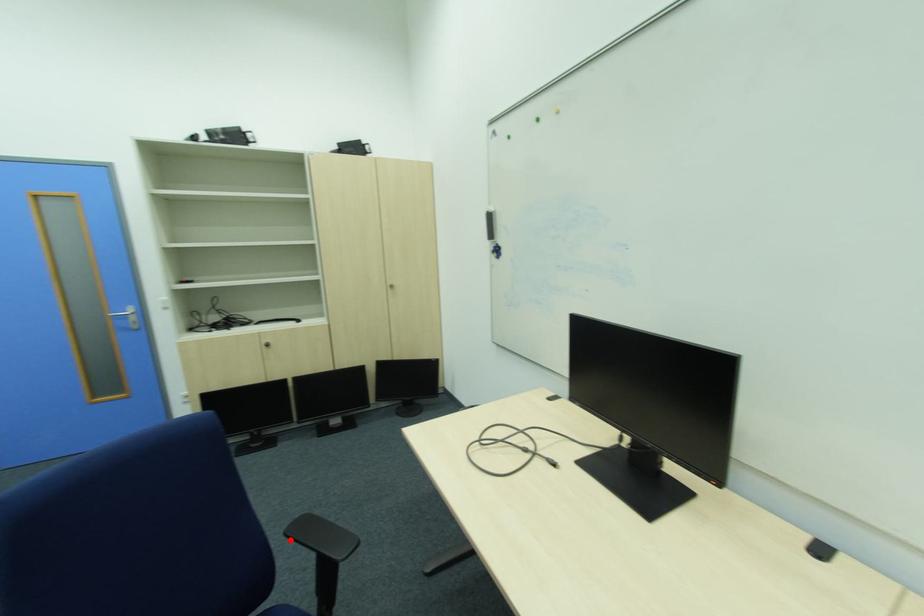
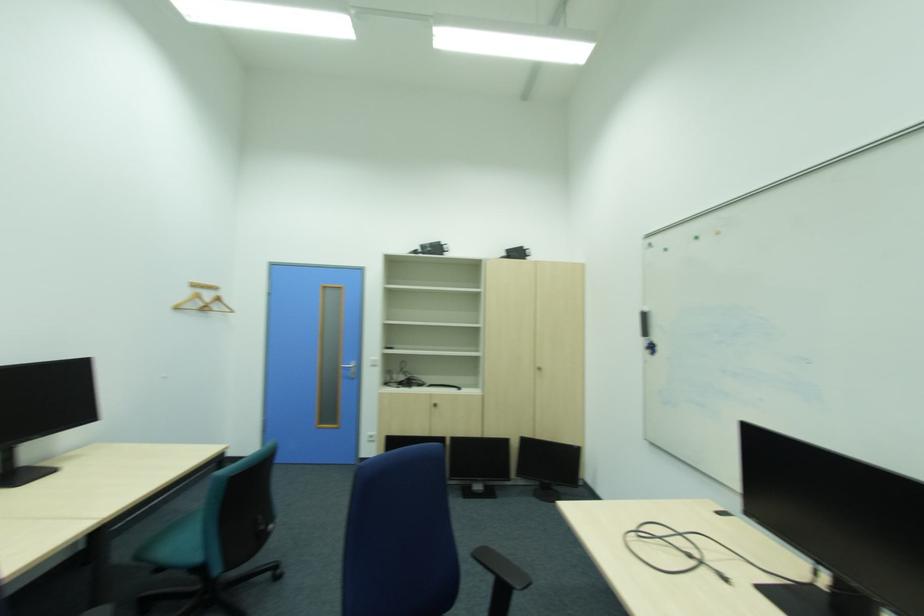
Question: I am providing you with two images of the same scene from different viewpoints. In image1, a red point is highlighted. Considering the same 3D point in image2, which of the following is correct?

Choices:
 (A) It is closer
 (B) It is farther

Answer: (A)